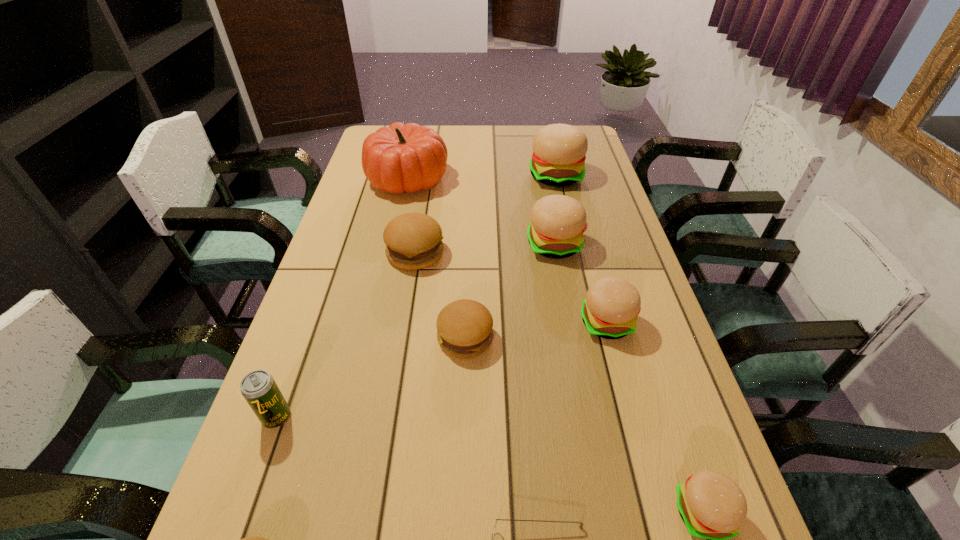
I want to click on pumpkin, so click(x=408, y=157).

Find the location of a particular element. This screenshot has height=540, width=960. the biggest beige hamburger is located at coordinates (559, 150).

Identify the location of the farthest hamburger. (559, 150).

Image resolution: width=960 pixels, height=540 pixels. What are the coordinates of `the sixth shortest hamburger` in the screenshot? It's located at (558, 222).

Find the location of `the third nearest beige hamburger`. the third nearest beige hamburger is located at coordinates (558, 222).

The image size is (960, 540). In order to click on beer can in this screenshot , I will do `click(259, 389)`.

Locate an element on the screen. This screenshot has height=540, width=960. the third farthest beige hamburger is located at coordinates (610, 309).

This screenshot has height=540, width=960. What are the coordinates of `the second brown hamburger from right to left` in the screenshot? It's located at (413, 241).

At what (x,y) coordinates should I click in order to perform the action: click on the biggest brown hamburger. Please return your answer as a coordinate pair (x, y). Looking at the image, I should click on (413, 241).

This screenshot has width=960, height=540. Identify the location of the third hamburger from left to right. (464, 327).